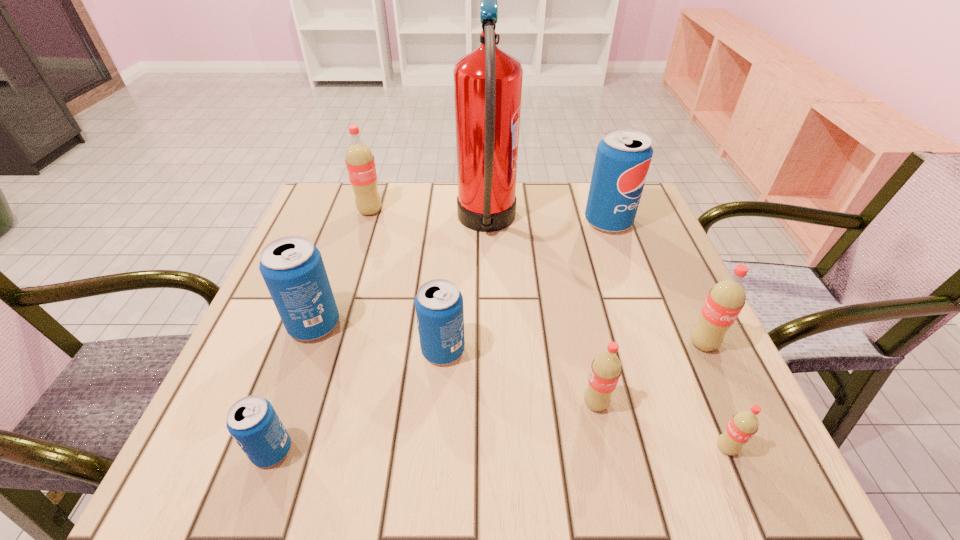
Find the location of a particular element. This screenshot has width=960, height=540. the fourth object from right to left is located at coordinates [x=606, y=368].

Locate an element on the screen. This screenshot has width=960, height=540. the fourth soda from right to left is located at coordinates (606, 368).

You are a GUI agent. You are given a task and a screenshot of the screen. Output one action in this format:
    pyautogui.click(x=<x>, y=<y>)
    Task: Click on the smallest blue soda can
    
    Given the screenshot: What is the action you would take?
    pyautogui.click(x=252, y=421)

Locate an element on the screen. This screenshot has height=540, width=960. the nearest red soda is located at coordinates (743, 425).

You are a GUI agent. You are given a task and a screenshot of the screen. Output one action in this format:
    pyautogui.click(x=<x>, y=<y>)
    Task: Click on the free spot located 0.080m on the front of the red fire extinguisher
    This screenshot has width=960, height=540.
    Given the screenshot: What is the action you would take?
    pyautogui.click(x=488, y=298)

The image size is (960, 540). I want to click on vacant region located on the front of the biggest blue soda can, so click(x=644, y=322).

Identify the location of free space located on the right of the leftmost red soda. Image resolution: width=960 pixels, height=540 pixels. (489, 211).

At what (x,y) coordinates should I click in order to perform the action: click on vacant space located on the right of the second biggest blue soda can. Please return your answer as a coordinate pair (x, y). This screenshot has height=540, width=960. Looking at the image, I should click on (450, 325).

You are a GUI agent. You are given a task and a screenshot of the screen. Output one action in this format:
    pyautogui.click(x=<x>, y=<y>)
    Task: Click on the free space located 0.130m on the back of the second biggest red soda
    The height and width of the screenshot is (540, 960).
    Given the screenshot: What is the action you would take?
    pyautogui.click(x=676, y=286)

I want to click on vacant region located 0.300m on the back of the third biggest blue soda can, so click(451, 239).